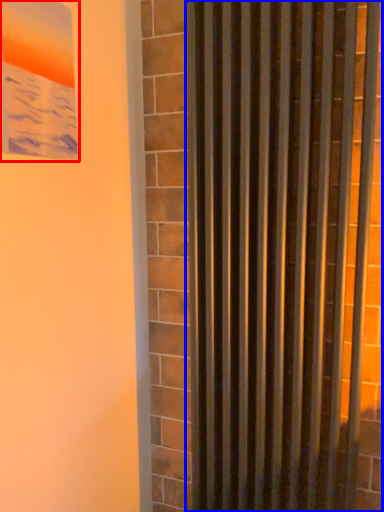
Question: Among these objects, which one is nearest to the camera, picture frame (highlighted by a red box) or curtain (highlighted by a blue box)?

Choices:
 (A) picture frame
 (B) curtain

Answer: (A)